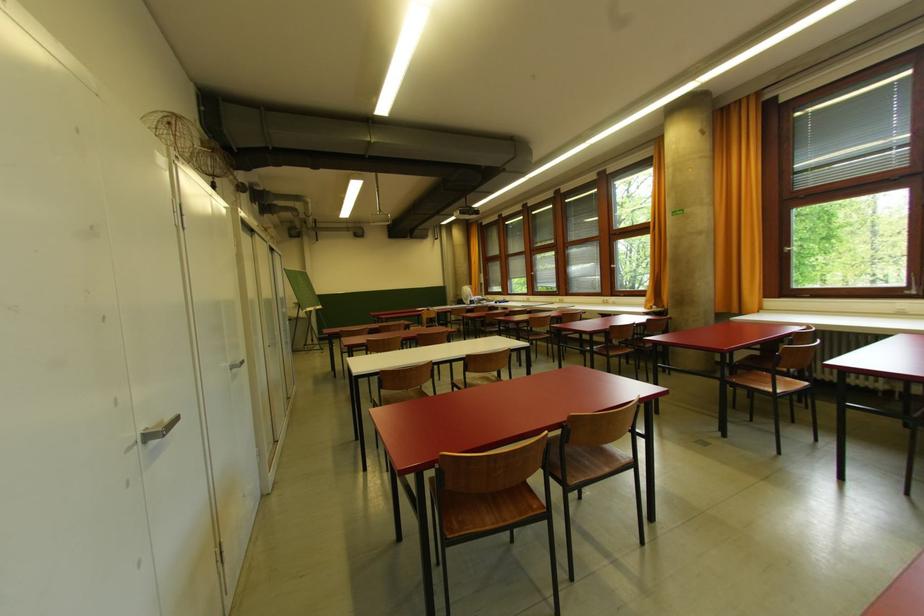
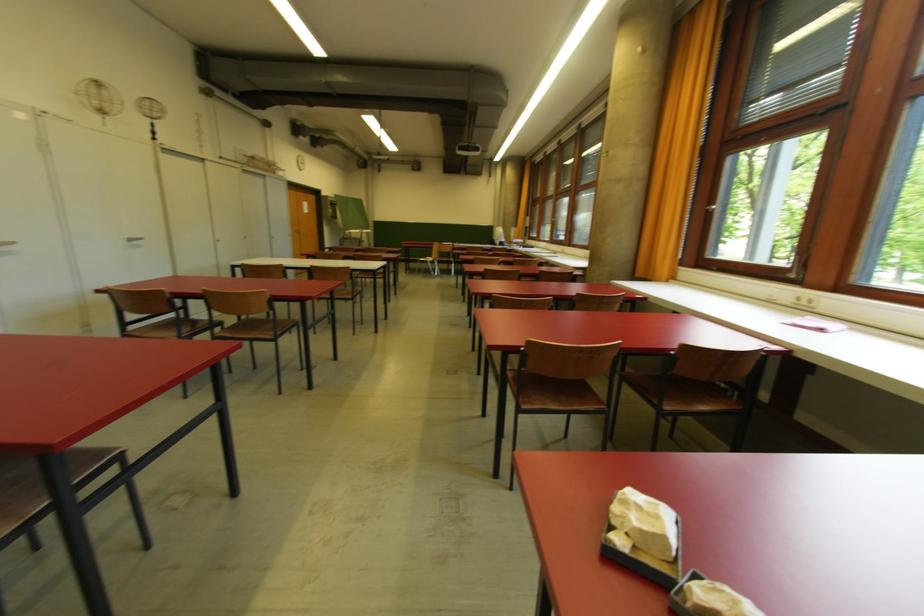
Where in the second image is the point corresponding to point (245, 363) from the first image?

(144, 241)